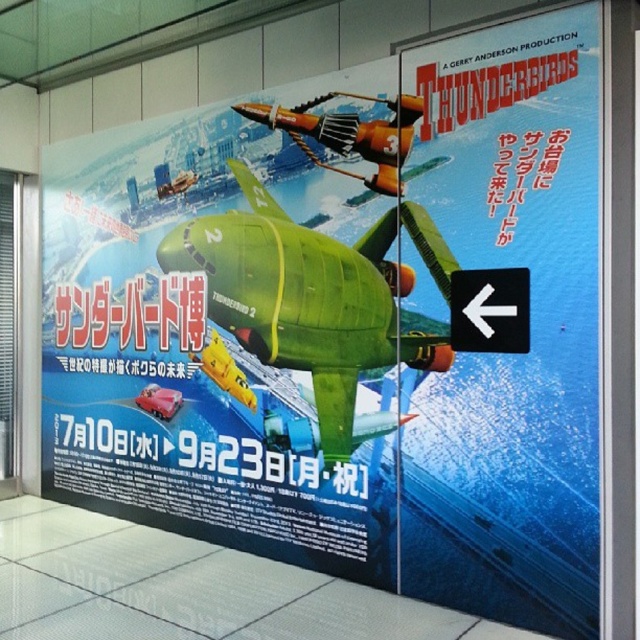
Based on the photo, looking at the Thunderbirds promotional poster, you notice the green matte thunderbird 2 at center and the orange metallic airplane at center. Which of these two vehicles is located to the left of the other?

The green matte thunderbird 2 at center is positioned on the left side of orange metallic airplane at center.

You are an artist trying to draw the Thunderbirds poster. You want to place a new sticker exactly at the point labeled point (x=316, y=296). According to the scene description, on which object should you place this sticker?

The point labeled point (x=316, y=296) is on the green matte Thunderbird 2 at center, so you should place the sticker on the green matte Thunderbird 2 at center.

Looking at the Thunderbirds promotional poster, you notice the green matte Thunderbird 2 at center and the orange metallic airplane at center. Which of these two vehicles is bigger in the poster?

Result: The green matte Thunderbird 2 at center is larger than the orange metallic airplane at center in the poster.